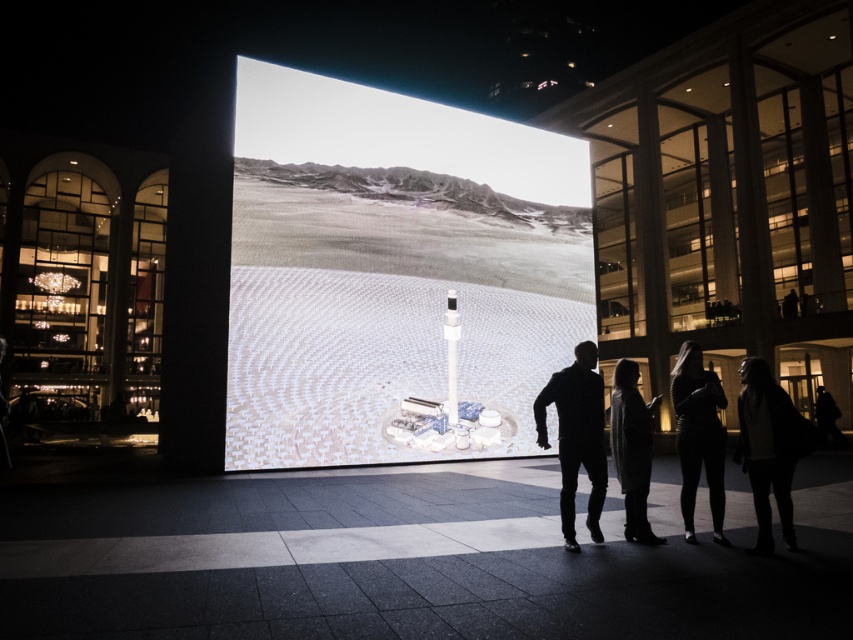
Who is lower down, white glossy solar panel at center or white glossy rectangular pillar at center?

Positioned lower is white glossy rectangular pillar at center.

Looking at this image, is white glossy solar panel at center thinner than white glossy rectangular pillar at center?

Incorrect, white glossy solar panel at center's width is not less than white glossy rectangular pillar at center's.

Which is in front, point (495, 355) or point (448, 323)?

Point (448, 323)

You are a GUI agent. You are given a task and a screenshot of the screen. Output one action in this format:
    pyautogui.click(x=<x>, y=<y>)
    Task: Click on the white glossy solar panel at center
    The height and width of the screenshot is (640, 853).
    Given the screenshot: What is the action you would take?
    pyautogui.click(x=393, y=273)

Can you confirm if black matte pants at lower right is thinner than white glossy rectangular pillar at center?

Incorrect, black matte pants at lower right's width is not less than white glossy rectangular pillar at center's.

Can you confirm if black matte pants at lower right is bigger than white glossy rectangular pillar at center?

Correct, black matte pants at lower right is larger in size than white glossy rectangular pillar at center.

The image size is (853, 640). Find the location of `black matte pants at lower right`. black matte pants at lower right is located at coordinates (576, 436).

Who is positioned more to the left, black matte pants at lower right or black leather jacket at lower right?

black matte pants at lower right

Is black matte pants at lower right positioned at the back of black leather jacket at lower right?

That is False.

What do you see at coordinates (576, 436) in the screenshot? I see `black matte pants at lower right` at bounding box center [576, 436].

In order to click on black matte pants at lower right in this screenshot , I will do `click(576, 436)`.